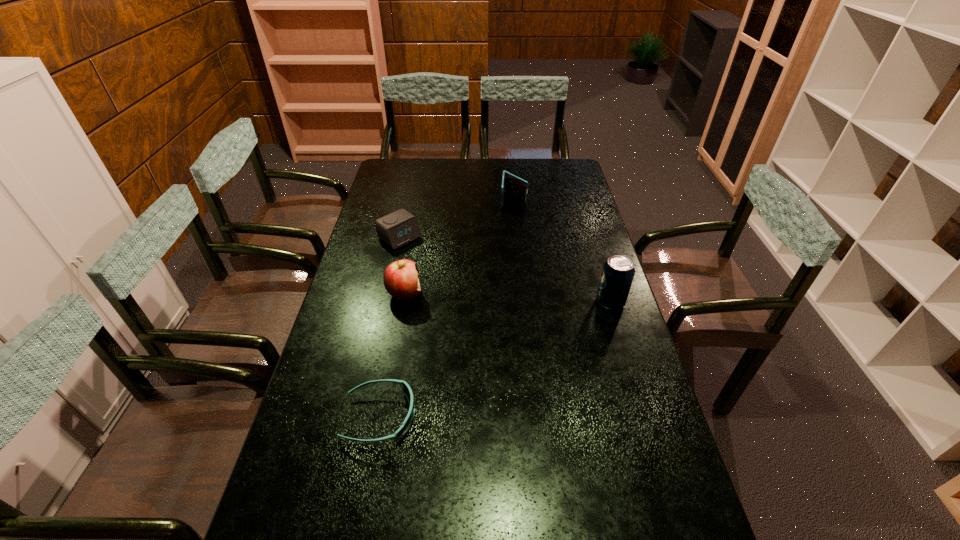
Locate an element on the screen. Image resolution: width=960 pixels, height=540 pixels. free spot that satisfies the following two spatial constraints: 1. on the front side of the sunglasses; 2. on the front-facing side of the alarm clock is located at coordinates (359, 417).

The width and height of the screenshot is (960, 540). In order to click on free space that satisfies the following two spatial constraints: 1. on the front side of the rightmost object; 2. on the left side of the fourth tallest object in this screenshot , I will do `click(385, 302)`.